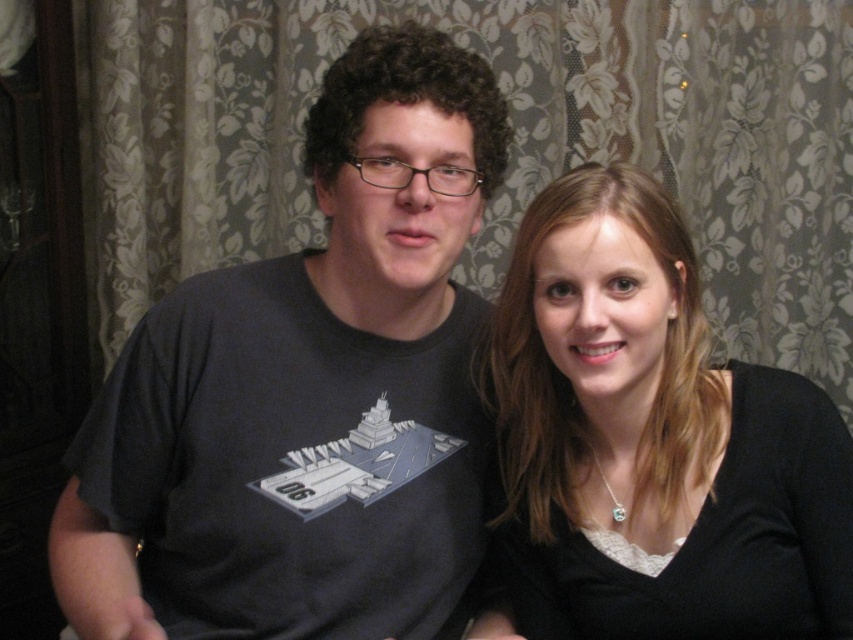
Question: Observing the image, what is the correct spatial positioning of dark gray t-shirt at center in reference to black matte shirt at right?

Choices:
 (A) above
 (B) below

Answer: (A)

Question: Which object is farther from the camera taking this photo?

Choices:
 (A) black matte shirt at right
 (B) dark gray t-shirt at center

Answer: (A)

Question: Which of the following is the farthest from the observer?

Choices:
 (A) dark gray t-shirt at center
 (B) black matte shirt at right

Answer: (B)

Question: Is dark gray t-shirt at center wider than black matte shirt at right?

Choices:
 (A) no
 (B) yes

Answer: (B)

Question: Among these objects, which one is farthest from the camera?

Choices:
 (A) black matte shirt at right
 (B) dark gray t-shirt at center

Answer: (A)

Question: Can you confirm if dark gray t-shirt at center is bigger than black matte shirt at right?

Choices:
 (A) no
 (B) yes

Answer: (B)